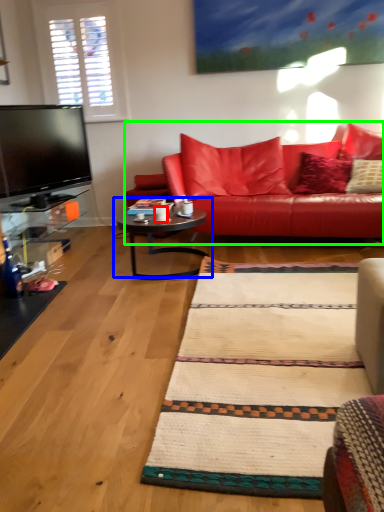
Question: Based on their relative distances, which object is farther from coffee cup (highlighted by a red box)? Choose from coffee table (highlighted by a blue box) and studio couch (highlighted by a green box).

Choices:
 (A) coffee table
 (B) studio couch

Answer: (B)